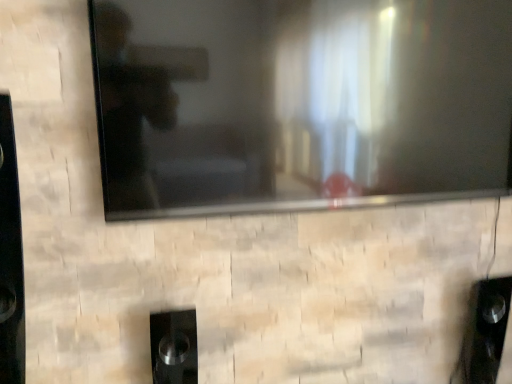
Question: Is black glossy tv at upper center not within black glossy speaker at lower center?

Choices:
 (A) no
 (B) yes

Answer: (B)

Question: Does black glossy tv at upper center have a larger size compared to black glossy speaker at lower center?

Choices:
 (A) no
 (B) yes

Answer: (B)

Question: Considering the relative sizes of black glossy tv at upper center and black glossy speaker at lower center in the image provided, is black glossy tv at upper center shorter than black glossy speaker at lower center?

Choices:
 (A) yes
 (B) no

Answer: (B)

Question: From a real-world perspective, is black glossy tv at upper center under black glossy speaker at lower center?

Choices:
 (A) no
 (B) yes

Answer: (A)

Question: From the image's perspective, is black glossy tv at upper center above black glossy speaker at lower center?

Choices:
 (A) no
 (B) yes

Answer: (B)

Question: Can you confirm if black glossy tv at upper center is positioned to the right of black glossy speaker at lower center?

Choices:
 (A) no
 (B) yes

Answer: (B)

Question: From a real-world perspective, is black glossy speaker at lower center physically above black glossy tv at upper center?

Choices:
 (A) no
 (B) yes

Answer: (A)

Question: Does black glossy speaker at lower center have a greater width compared to black glossy tv at upper center?

Choices:
 (A) no
 (B) yes

Answer: (B)

Question: Is black glossy tv at upper center a part of black glossy speaker at lower center?

Choices:
 (A) yes
 (B) no

Answer: (B)

Question: Does black glossy speaker at lower center appear on the left side of black glossy tv at upper center?

Choices:
 (A) no
 (B) yes

Answer: (B)

Question: Is black glossy speaker at lower center far from black glossy tv at upper center?

Choices:
 (A) no
 (B) yes

Answer: (A)

Question: Is black glossy speaker at lower center facing towards black glossy tv at upper center?

Choices:
 (A) yes
 (B) no

Answer: (B)

Question: From the image's perspective, is black glossy tv at upper center positioned above or below black glossy speaker at lower center?

Choices:
 (A) below
 (B) above

Answer: (B)